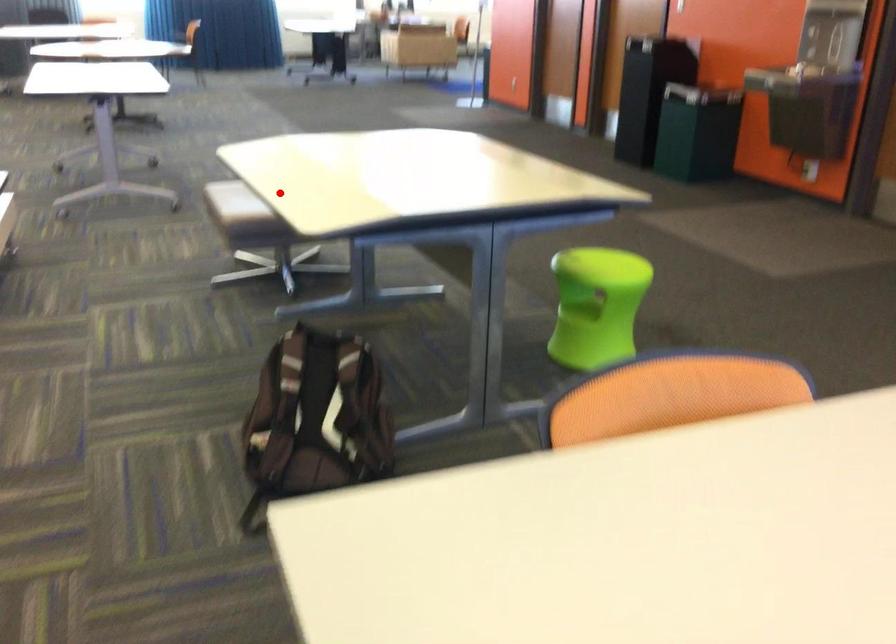
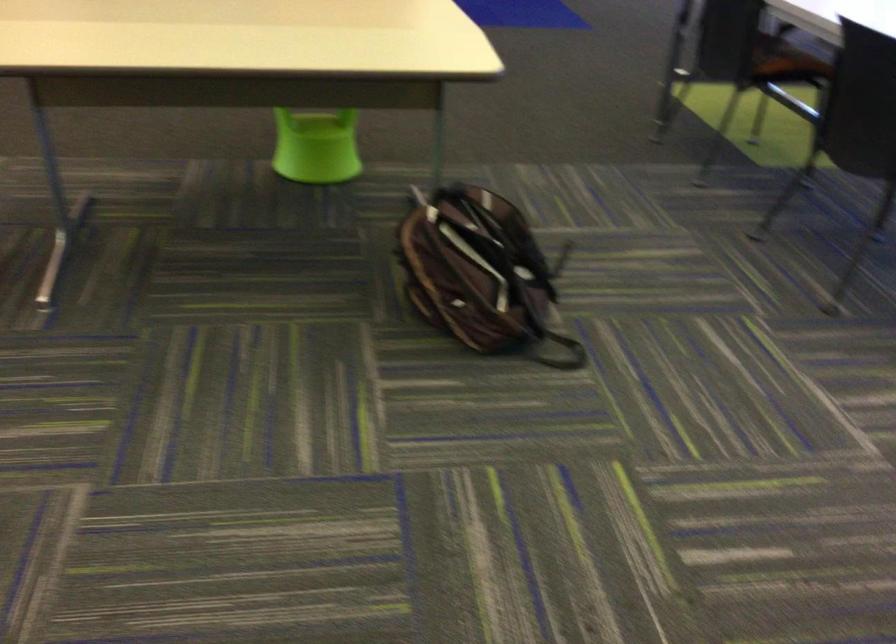
Question: I am providing you with two images of the same scene from different viewpoints. A red point is shown in image1. For the corresponding object point in image2, is it positioned nearer or farther from the camera?

Choices:
 (A) Nearer
 (B) Farther

Answer: (A)